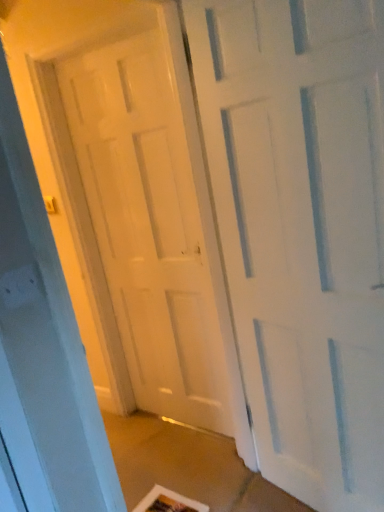
What do you see at coordinates (302, 229) in the screenshot? The image size is (384, 512). I see `white matte door at center, which is counted as the second door, starting from the back` at bounding box center [302, 229].

In order to click on white matte door at center, which is counted as the second door, starting from the back in this screenshot , I will do `click(302, 229)`.

How much space does white matte door at center, which is counted as the second door, starting from the back, occupy vertically?

It is 6.35 feet.

Where is `white glossy door at center, the first door from the back`? The width and height of the screenshot is (384, 512). white glossy door at center, the first door from the back is located at coordinates (147, 226).

What is the approximate height of white glossy door at center, positioned as the 2th door in front-to-back order?

white glossy door at center, positioned as the 2th door in front-to-back order, is 6.41 feet tall.

The image size is (384, 512). What do you see at coordinates (147, 226) in the screenshot?
I see `white glossy door at center, positioned as the 2th door in front-to-back order` at bounding box center [147, 226].

Where is `white matte door at center, which is counted as the second door, starting from the back`? The image size is (384, 512). white matte door at center, which is counted as the second door, starting from the back is located at coordinates (302, 229).

Is white glossy door at center, the first door from the back, at the right side of white matte door at center, which is counted as the second door, starting from the back?

Incorrect, white glossy door at center, the first door from the back, is not on the right side of white matte door at center, which is counted as the second door, starting from the back.

Which object is further away from the camera, white glossy door at center, positioned as the 2th door in front-to-back order, or white matte door at center, which is counted as the second door, starting from the back?

white glossy door at center, positioned as the 2th door in front-to-back order, is further from the camera.

Does point (163, 293) appear closer or farther from the camera than point (279, 339)?

Point (163, 293).

From the image's perspective, would you say white glossy door at center, the first door from the back, is shown under white matte door at center, which is counted as the second door, starting from the back?

No, from the image's perspective, white glossy door at center, the first door from the back, is not beneath white matte door at center, which is counted as the second door, starting from the back.

From a real-world perspective, is white glossy door at center, positioned as the 2th door in front-to-back order, on white matte door at center, which is the first door in front-to-back order?

Indeed, from a real-world perspective, white glossy door at center, positioned as the 2th door in front-to-back order, stands above white matte door at center, which is the first door in front-to-back order.

Considering the relative sizes of white glossy door at center, the first door from the back, and white matte door at center, which is counted as the second door, starting from the back, in the image provided, is white glossy door at center, the first door from the back, thinner than white matte door at center, which is counted as the second door, starting from the back,?

Indeed, white glossy door at center, the first door from the back, has a lesser width compared to white matte door at center, which is counted as the second door, starting from the back.

Is white glossy door at center, the first door from the back, shorter than white matte door at center, which is counted as the second door, starting from the back?

Incorrect, the height of white glossy door at center, the first door from the back, does not fall short of that of white matte door at center, which is counted as the second door, starting from the back.

Who is bigger, white glossy door at center, the first door from the back, or white matte door at center, which is the first door in front-to-back order?

white matte door at center, which is the first door in front-to-back order, is bigger.

Choose the correct answer: Is white glossy door at center, positioned as the 2th door in front-to-back order, inside white matte door at center, which is the first door in front-to-back order, or outside it?

The correct answer is: outside.

Is white glossy door at center, the first door from the back, far from white matte door at center, which is the first door in front-to-back order?

No, white glossy door at center, the first door from the back, is in close proximity to white matte door at center, which is the first door in front-to-back order.

Is white glossy door at center, positioned as the 2th door in front-to-back order, oriented towards white matte door at center, which is the first door in front-to-back order?

No, white glossy door at center, positioned as the 2th door in front-to-back order, does not turn towards white matte door at center, which is the first door in front-to-back order.

How many degrees apart are the facing directions of white glossy door at center, positioned as the 2th door in front-to-back order, and white matte door at center, which is the first door in front-to-back order?

15.4 degrees.

Measure the distance between white glossy door at center, the first door from the back, and white matte door at center, which is the first door in front-to-back order.

24.86 inches.

Find the location of `door behind the white matte door at center, which is counted as the second door, starting from the back`. door behind the white matte door at center, which is counted as the second door, starting from the back is located at coordinates (147, 226).

Considering the positions of objects white matte door at center, which is the first door in front-to-back order, and white glossy door at center, positioned as the 2th door in front-to-back order, in the image provided, who is more to the right, white matte door at center, which is the first door in front-to-back order, or white glossy door at center, positioned as the 2th door in front-to-back order,?

white matte door at center, which is the first door in front-to-back order, is more to the right.

Which object is further away from the camera, white matte door at center, which is counted as the second door, starting from the back, or white glossy door at center, the first door from the back?

white glossy door at center, the first door from the back, is further away from the camera.

Considering the positions of point (297, 243) and point (148, 281), is point (297, 243) closer or farther from the camera than point (148, 281)?

Clearly, point (297, 243) is closer to the camera than point (148, 281).

Looking at this image, from the image's perspective, is white matte door at center, which is counted as the second door, starting from the back, positioned above or below white glossy door at center, the first door from the back?

white matte door at center, which is counted as the second door, starting from the back, is situated lower than white glossy door at center, the first door from the back, in the image.

From a real-world perspective, which is physically above, white matte door at center, which is the first door in front-to-back order, or white glossy door at center, positioned as the 2th door in front-to-back order?

From a 3D spatial view, white glossy door at center, positioned as the 2th door in front-to-back order, is above.

Which of these two, white matte door at center, which is counted as the second door, starting from the back, or white glossy door at center, the first door from the back, is thinner?

With smaller width is white glossy door at center, the first door from the back.

Which of these two, white matte door at center, which is the first door in front-to-back order, or white glossy door at center, the first door from the back, stands taller?

white glossy door at center, the first door from the back.

Looking at the image, does white matte door at center, which is the first door in front-to-back order, seem bigger or smaller compared to white glossy door at center, the first door from the back?

white matte door at center, which is the first door in front-to-back order, is bigger than white glossy door at center, the first door from the back.

Would you say white matte door at center, which is the first door in front-to-back order, contains white glossy door at center, positioned as the 2th door in front-to-back order?

Definitely not — white glossy door at center, positioned as the 2th door in front-to-back order, is not inside white matte door at center, which is the first door in front-to-back order.

Are white matte door at center, which is counted as the second door, starting from the back, and white glossy door at center, the first door from the back, beside each other?

white matte door at center, which is counted as the second door, starting from the back, is not next to white glossy door at center, the first door from the back, and they're not touching.

Is white matte door at center, which is counted as the second door, starting from the back, positioned with its back to white glossy door at center, positioned as the 2th door in front-to-back order?

No, white matte door at center, which is counted as the second door, starting from the back, is not facing away from white glossy door at center, positioned as the 2th door in front-to-back order.

What's the angular difference between white matte door at center, which is the first door in front-to-back order, and white glossy door at center, positioned as the 2th door in front-to-back order,'s facing directions?

The facing directions of white matte door at center, which is the first door in front-to-back order, and white glossy door at center, positioned as the 2th door in front-to-back order, are 15.4 degrees apart.

Image resolution: width=384 pixels, height=512 pixels. In order to click on door on the right of white glossy door at center, positioned as the 2th door in front-to-back order in this screenshot , I will do `click(302, 229)`.

What are the coordinates of `door behind the white matte door at center, which is counted as the second door, starting from the back` in the screenshot? It's located at (147, 226).

Identify the location of door in front of the white glossy door at center, the first door from the back. This screenshot has width=384, height=512. (302, 229).